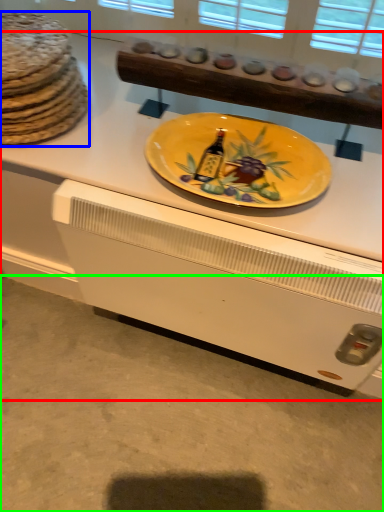
Question: Estimate the real-world distances between objects in this image. Which object is farther from desk (highlighted by a red box), chocolate cake (highlighted by a blue box) or concrete (highlighted by a green box)?

Choices:
 (A) chocolate cake
 (B) concrete

Answer: (B)